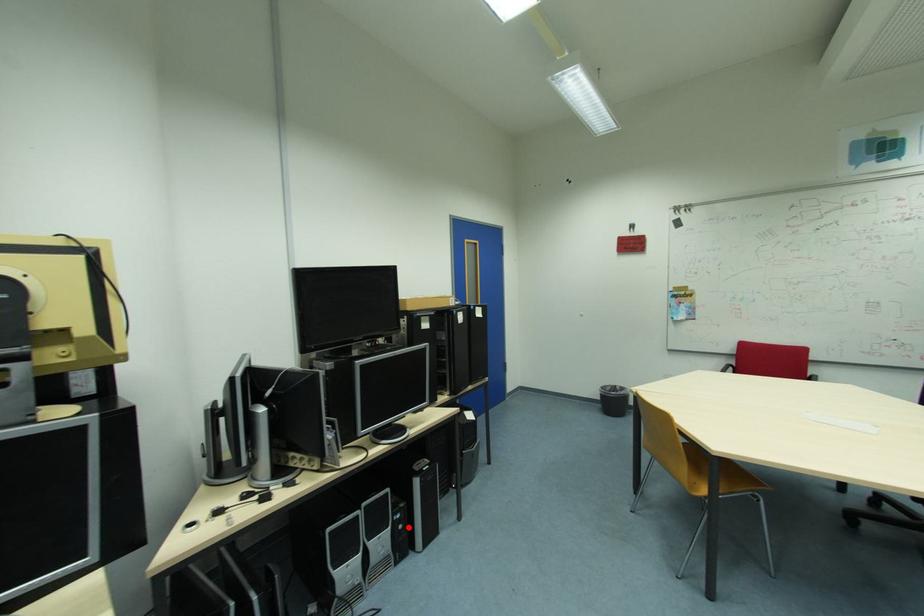
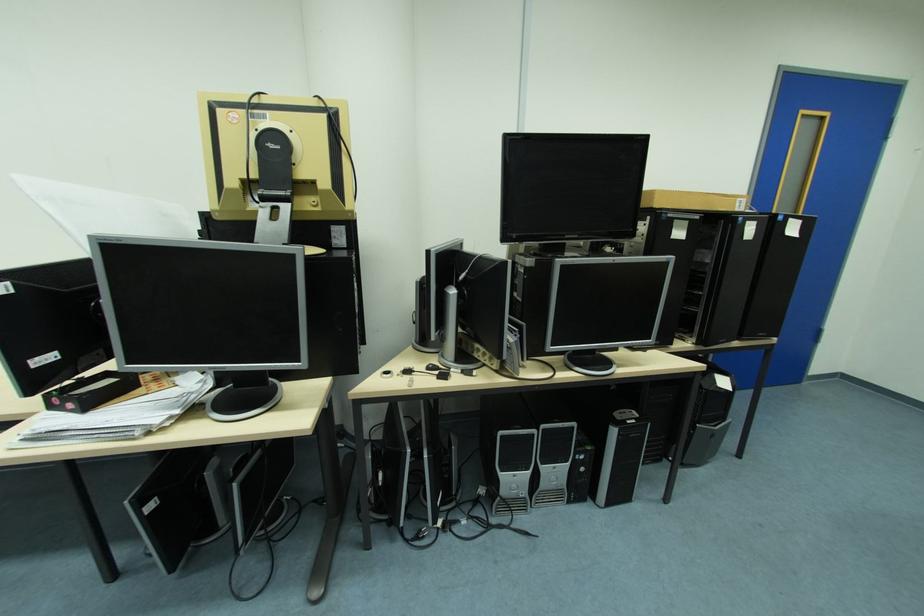
The point at the highlighted location is marked in the first image. Where is the corresponding point in the second image?

(590, 469)